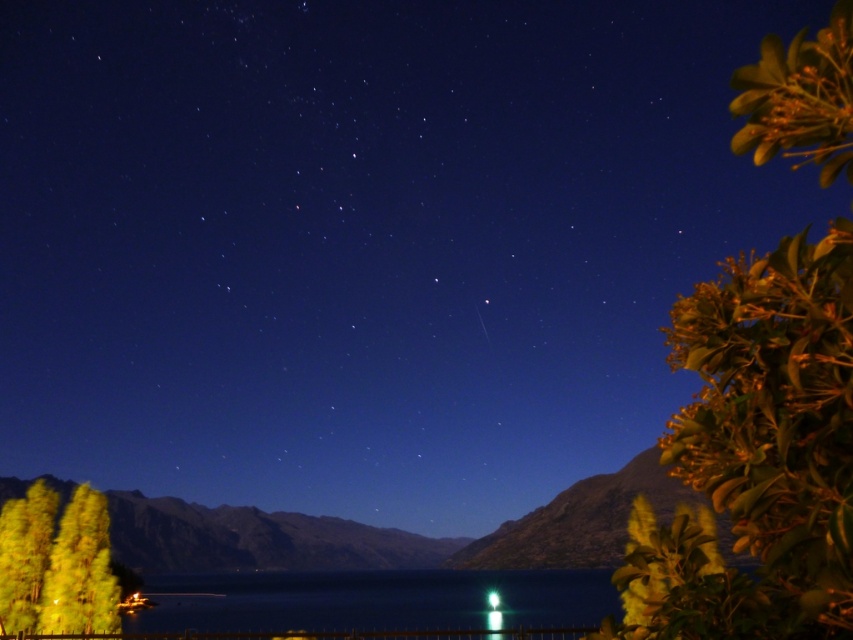
You are an artist trying to paint the scene. You need to decide which object to paint first based on their sizes. Which one should you start with, the green glossy leaves at upper right or the green translucent light at lower center?

The green glossy leaves at upper right are wider than the green translucent light at lower center, so you should start painting the green glossy leaves at upper right first to ensure proper scaling.

You are an observer looking at the scene. Which object, the green glossy leaves at upper right or the shiny blue water at center, is closer to the bottom of the image?

The shiny blue water at center is closer to the bottom of the image because the green glossy leaves at upper right is shorter than it.